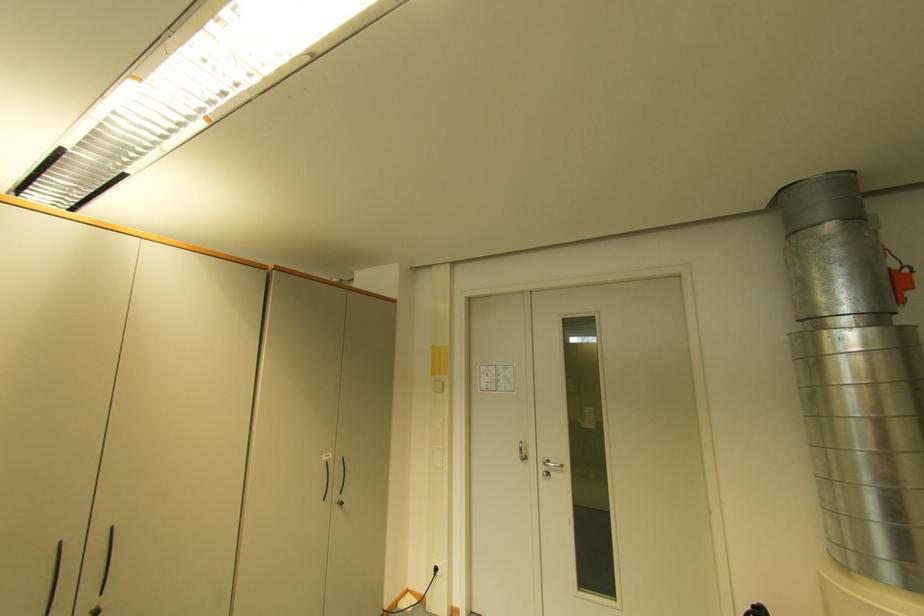
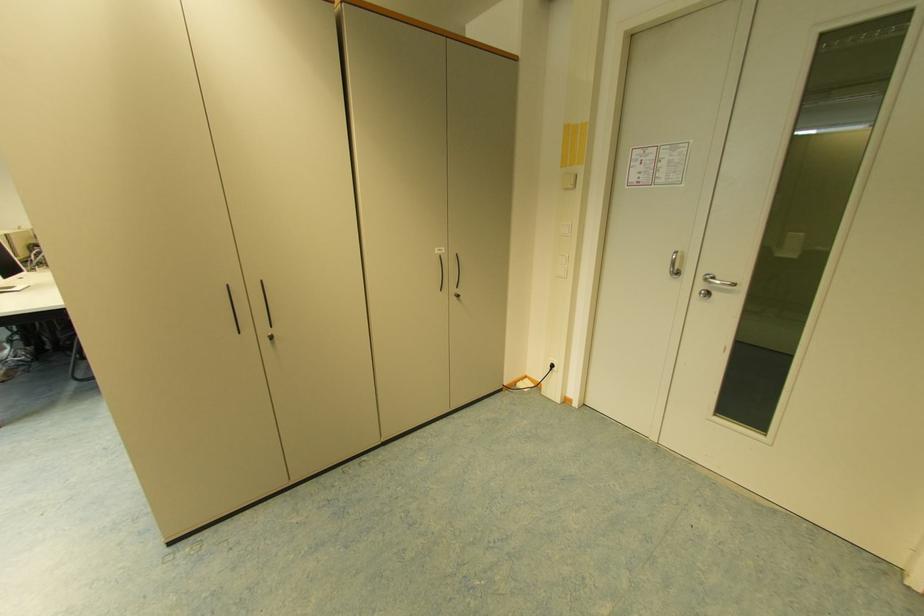
The point at [529,459] is marked in the first image. Where is the corresponding point in the second image?

(681, 274)